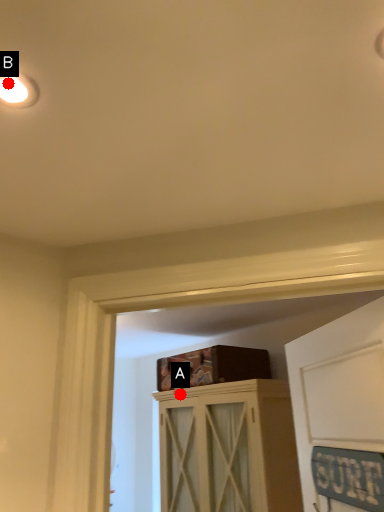
Question: Two points are circled on the image, labeled by A and B beside each circle. Which point appears farthest from the camera in this image?

Choices:
 (A) A is further
 (B) B is further

Answer: (A)